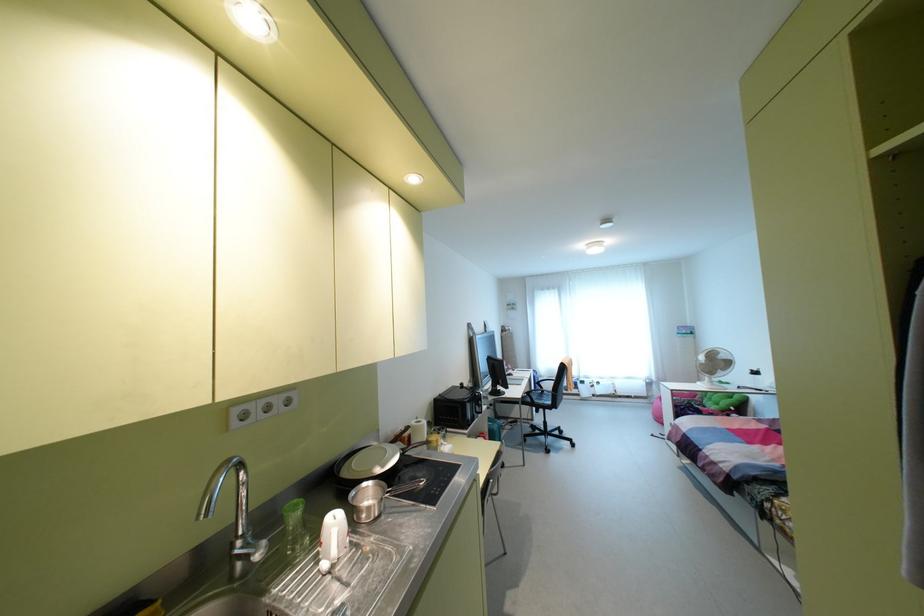
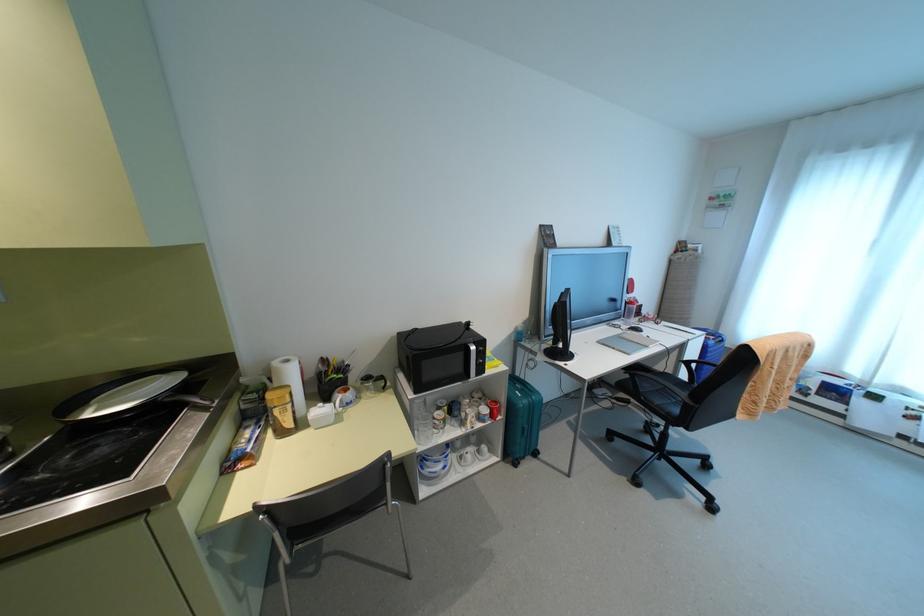
Locate, in the second image, the point that corresponds to the point at 502,464 in the first image.

(535, 454)